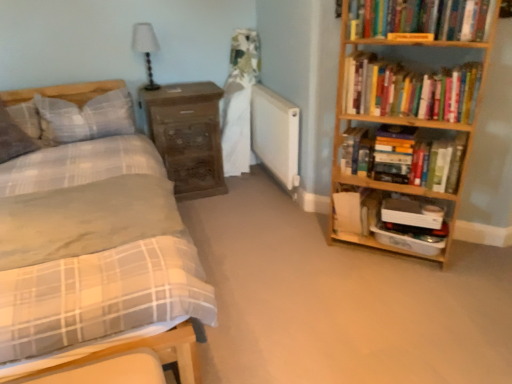
Question: Does point (387, 51) appear closer or farther from the camera than point (1, 135)?

Choices:
 (A) farther
 (B) closer

Answer: (B)

Question: Based on their sizes in the image, would you say wooden bookcase at right is bigger or smaller than plaid fabric pillow at left, which appears as the second pillow when viewed from the right?

Choices:
 (A) big
 (B) small

Answer: (A)

Question: Which is farther from the wooden bookcase at right?

Choices:
 (A) hardcover book at center right, the 2th paperback book when ordered from top to bottom
 (B) hardcover book at upper right, which is the 1th paperback book in top-to-bottom order
 (C) hardcover books at upper right, which appears as the 2th book when viewed from the top
 (D) plaid fabric pillow at left, the 2th pillow in the left-to-right sequence
 (E) matte wooden bed at left

Answer: (D)

Question: Estimate the real-world distances between objects in this image. Which object is farther from the wooden cabinet at lower right?

Choices:
 (A) hardcover book at upper right, acting as the 1th book starting from the top
 (B) hardcover books at upper right, which is the 2th book in bottom-to-top order
 (C) hardcover books at right, which ranks as the first book in bottom-to-top order
 (D) matte wooden bed at left
 (E) wooden bookcase at right

Answer: (D)